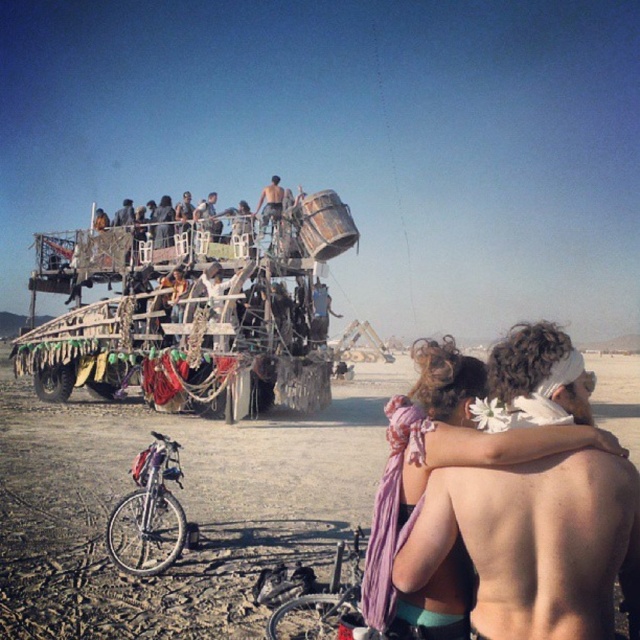
Question: Which of these objects is positioned closest to the wooden plank at center?

Choices:
 (A) shiny silver hair at upper center
 (B) dirt field at lower center
 (C) shiny metallic tank top at center

Answer: (C)

Question: Is dirt field at lower center bigger than wooden plank at center?

Choices:
 (A) no
 (B) yes

Answer: (B)

Question: Among these objects, which one is nearest to the camera?

Choices:
 (A) wooden plank at center
 (B) shiny silver hair at upper center

Answer: (B)

Question: Which point appears farthest from the camera in this image?

Choices:
 (A) (76, 465)
 (B) (275, 195)

Answer: (B)

Question: Considering the relative positions of dirt field at lower center and shiny metallic tank top at center in the image provided, where is dirt field at lower center located with respect to shiny metallic tank top at center?

Choices:
 (A) above
 (B) below

Answer: (B)

Question: Does dirt field at lower center have a greater width compared to wooden plank at center?

Choices:
 (A) yes
 (B) no

Answer: (A)